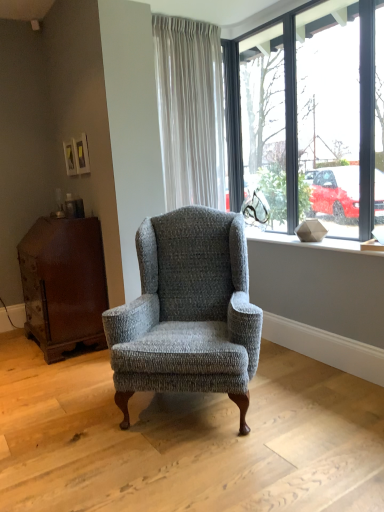
The width and height of the screenshot is (384, 512). Describe the element at coordinates (187, 311) in the screenshot. I see `textured gray wingback chair at center` at that location.

The image size is (384, 512). What are the coordinates of `clear glass window at upper right` in the screenshot? It's located at (313, 119).

Find the location of a particular element. dark brown wood dresser at left is located at coordinates pyautogui.click(x=63, y=284).

Considering the sizes of dark brown wood dresser at left and matte gray stone at upper right in the image, is dark brown wood dresser at left wider or thinner than matte gray stone at upper right?

dark brown wood dresser at left is wider than matte gray stone at upper right.

What are the coordinates of `window sill above the dark brown wood dresser at left (from the image's perspective)` in the screenshot? It's located at (309, 242).

Does dark brown wood dresser at left turn towards matte gray stone at upper right?

No, dark brown wood dresser at left is not facing towards matte gray stone at upper right.

Is the depth of dark brown wood dresser at left less than that of matte gray stone at upper right?

No, dark brown wood dresser at left is behind matte gray stone at upper right.

Can you confirm if white textured curtain at upper center is shorter than clear glass window at upper right?

Indeed, white textured curtain at upper center has a lesser height compared to clear glass window at upper right.

Which object is closer to the camera taking this photo, white textured curtain at upper center or clear glass window at upper right?

clear glass window at upper right is closer to the camera.

From the image's perspective, is white textured curtain at upper center below clear glass window at upper right?

Incorrect, from the image's perspective, white textured curtain at upper center is higher than clear glass window at upper right.

Is point (155, 55) less distant than point (376, 150)?

No, it is not.

Which of these two, dark brown wood dresser at left or textured gray wingback chair at center, stands shorter?

dark brown wood dresser at left.

Which point is more distant from viewer, (96, 217) or (168, 268)?

The point (96, 217) is farther.

From a real-world perspective, is dark brown wood dresser at left physically below textured gray wingback chair at center?

Yes, from a real-world perspective, dark brown wood dresser at left is under textured gray wingback chair at center.

How different are the orientations of dark brown wood dresser at left and textured gray wingback chair at center in degrees?

They differ by 48.6 degrees in their facing directions.

Can you confirm if clear glass window at upper right is taller than dark brown wood dresser at left?

Indeed, clear glass window at upper right has a greater height compared to dark brown wood dresser at left.

From a real-world perspective, who is located lower, clear glass window at upper right or dark brown wood dresser at left?

dark brown wood dresser at left, from a real-world perspective.

From the image's perspective, does clear glass window at upper right appear higher than dark brown wood dresser at left?

Yes, from the image's perspective, clear glass window at upper right is over dark brown wood dresser at left.

Considering the positions of objects matte gray stone at upper right and dark brown wood dresser at left in the image provided, who is more to the left, matte gray stone at upper right or dark brown wood dresser at left?

dark brown wood dresser at left is more to the left.

Which object is wider, matte gray stone at upper right or dark brown wood dresser at left?

With larger width is dark brown wood dresser at left.

Does matte gray stone at upper right have a smaller size compared to dark brown wood dresser at left?

Indeed, matte gray stone at upper right has a smaller size compared to dark brown wood dresser at left.

Are dark brown wood dresser at left and white textured curtain at upper center making contact?

No, dark brown wood dresser at left is not touching white textured curtain at upper center.

From the image's perspective, is dark brown wood dresser at left located beneath white textured curtain at upper center?

Yes.

Is white textured curtain at upper center a part of dark brown wood dresser at left?

That's incorrect, white textured curtain at upper center is not inside dark brown wood dresser at left.

Considering the relative sizes of white textured curtain at upper center and matte gray stone at upper right in the image provided, is white textured curtain at upper center wider than matte gray stone at upper right?

Incorrect, the width of white textured curtain at upper center does not surpass that of matte gray stone at upper right.

Would you say white textured curtain at upper center is a long distance from matte gray stone at upper right?

Yes, white textured curtain at upper center and matte gray stone at upper right are located far from each other.

Consider the image. From a real-world perspective, is white textured curtain at upper center above or below matte gray stone at upper right?

In terms of real-world spatial position, white textured curtain at upper center is above matte gray stone at upper right.

Where is `dresser that appears below the matte gray stone at upper right (from a real-world perspective)`? This screenshot has width=384, height=512. dresser that appears below the matte gray stone at upper right (from a real-world perspective) is located at coordinates (63, 284).

What are the coordinates of `window located on the right of white textured curtain at upper center` in the screenshot? It's located at (x=313, y=119).

Estimate the real-world distances between objects in this image. Which object is further from textured gray wingback chair at center, white textured curtain at upper center or dark brown wood dresser at left?

white textured curtain at upper center.

Looking at the image, which one is located closer to white textured curtain at upper center, textured gray wingback chair at center or clear glass window at upper right?

The object closer to white textured curtain at upper center is clear glass window at upper right.

From the image, which object appears to be farther from matte gray stone at upper right, white textured curtain at upper center or dark brown wood dresser at left?

Among the two, dark brown wood dresser at left is located further to matte gray stone at upper right.

When comparing their distances from clear glass window at upper right, does matte gray stone at upper right or dark brown wood dresser at left seem closer?

matte gray stone at upper right lies closer to clear glass window at upper right than the other object.

Estimate the real-world distances between objects in this image. Which object is closer to clear glass window at upper right, white textured curtain at upper center or textured gray wingback chair at center?

white textured curtain at upper center is closer to clear glass window at upper right.

Based on their spatial positions, is white textured curtain at upper center or clear glass window at upper right closer to matte gray stone at upper right?

clear glass window at upper right lies closer to matte gray stone at upper right than the other object.

From the image, which object appears to be nearer to dark brown wood dresser at left, white textured curtain at upper center or clear glass window at upper right?

white textured curtain at upper center is closer to dark brown wood dresser at left.

Considering their positions, is dark brown wood dresser at left positioned further to clear glass window at upper right than white textured curtain at upper center?

Among the two, dark brown wood dresser at left is located further to clear glass window at upper right.

Image resolution: width=384 pixels, height=512 pixels. What are the coordinates of `window sill between white textured curtain at upper center and textured gray wingback chair at center from top to bottom` in the screenshot? It's located at (309, 242).

Where is `window located between dark brown wood dresser at left and matte gray stone at upper right in the left-right direction`? This screenshot has width=384, height=512. window located between dark brown wood dresser at left and matte gray stone at upper right in the left-right direction is located at coordinates (313, 119).

Locate an element on the screen. The image size is (384, 512). chair between dark brown wood dresser at left and matte gray stone at upper right is located at coordinates (187, 311).

Find the location of a particular element. Image resolution: width=384 pixels, height=512 pixels. curtain located between dark brown wood dresser at left and matte gray stone at upper right in the left-right direction is located at coordinates (190, 111).